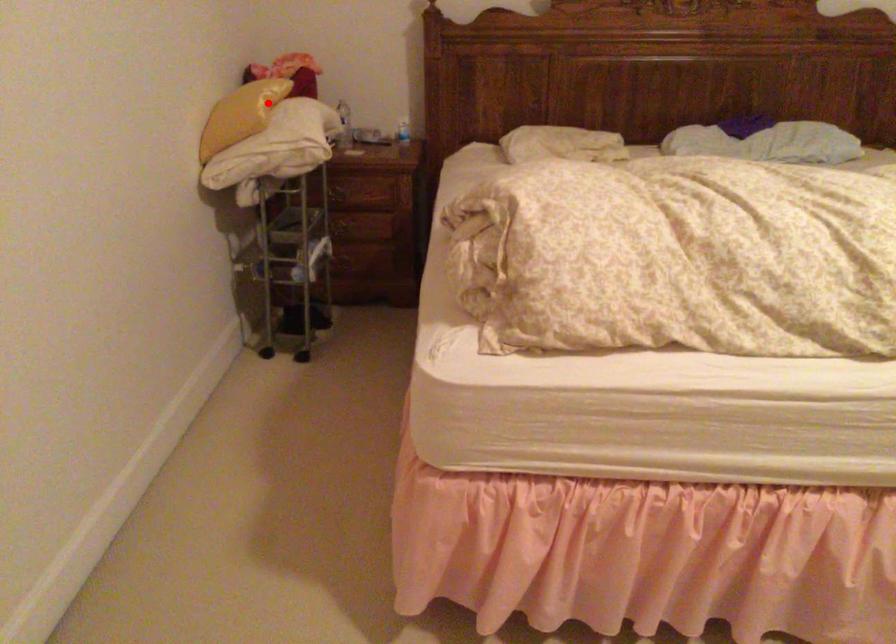
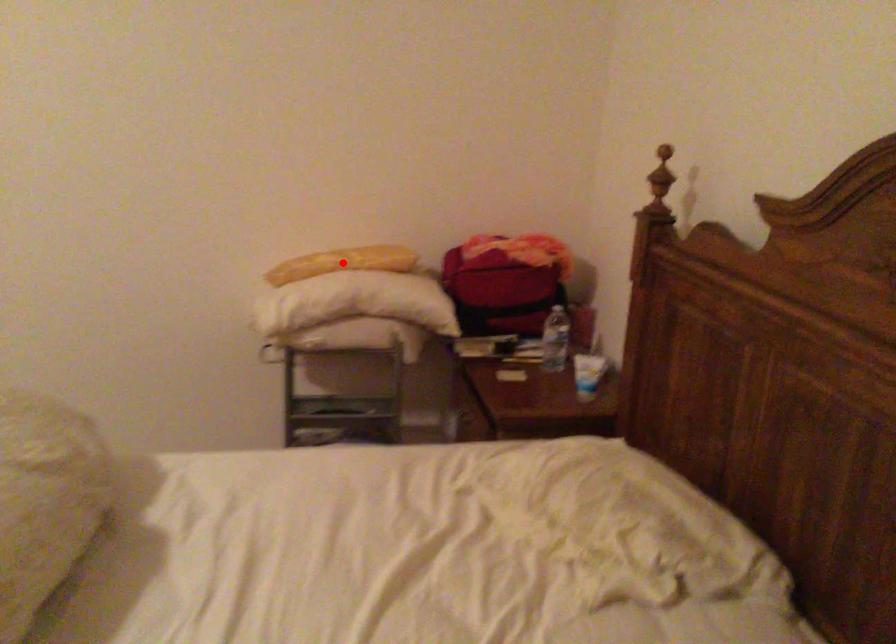
I am providing you with two images of the same scene from different viewpoints. A red point is marked on the first image and another point is marked on the second image. Is the marked point in image1 the same physical position as the marked point in image2?

Result: Yes